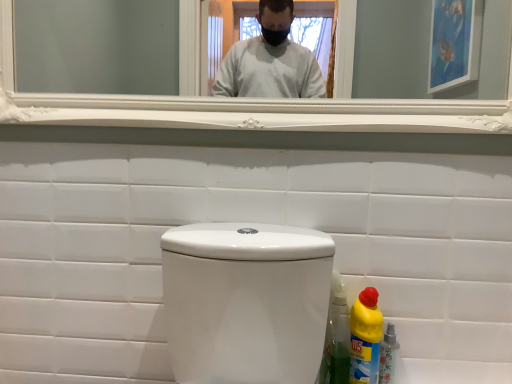
Question: Does yellow plastic bottle at lower right, positioned as the 2th bottle in left-to-right order, appear on the left side of white glossy toilet at center?

Choices:
 (A) no
 (B) yes

Answer: (A)

Question: Does yellow plastic bottle at lower right, positioned as the 2th bottle in left-to-right order, have a lesser height compared to white glossy toilet at center?

Choices:
 (A) no
 (B) yes

Answer: (B)

Question: Can you confirm if yellow plastic bottle at lower right, positioned as the 2th bottle in left-to-right order, is positioned to the right of white glossy toilet at center?

Choices:
 (A) yes
 (B) no

Answer: (A)

Question: Does yellow plastic bottle at lower right, positioned as the 2th bottle in left-to-right order, have a greater width compared to white glossy toilet at center?

Choices:
 (A) no
 (B) yes

Answer: (B)

Question: Are yellow plastic bottle at lower right, which is counted as the first bottle, starting from the right, and white glossy toilet at center far apart?

Choices:
 (A) yes
 (B) no

Answer: (B)

Question: From a real-world perspective, is yellow plastic bottle at lower right, positioned as the 2th bottle in left-to-right order, physically above white glossy toilet at center?

Choices:
 (A) no
 (B) yes

Answer: (A)

Question: Is white glossy mirror at upper center looking in the opposite direction of yellow plastic bottle at lower right, which is counted as the first bottle, starting from the right?

Choices:
 (A) no
 (B) yes

Answer: (A)

Question: Is white glossy mirror at upper center in front of yellow plastic bottle at lower right, positioned as the 2th bottle in left-to-right order?

Choices:
 (A) no
 (B) yes

Answer: (B)

Question: From the image's perspective, is white glossy mirror at upper center on yellow plastic bottle at lower right, positioned as the 2th bottle in left-to-right order?

Choices:
 (A) yes
 (B) no

Answer: (A)

Question: Is white glossy mirror at upper center touching yellow plastic bottle at lower right, which is counted as the first bottle, starting from the right?

Choices:
 (A) yes
 (B) no

Answer: (B)

Question: Can you confirm if white glossy mirror at upper center is shorter than yellow plastic bottle at lower right, positioned as the 2th bottle in left-to-right order?

Choices:
 (A) no
 (B) yes

Answer: (A)

Question: From a real-world perspective, is white glossy mirror at upper center over yellow plastic bottle at lower right, positioned as the 2th bottle in left-to-right order?

Choices:
 (A) no
 (B) yes

Answer: (B)

Question: Is yellow plastic bottle at lower right, the first bottle in the left-to-right sequence, bigger than white glossy toilet at center?

Choices:
 (A) no
 (B) yes

Answer: (A)